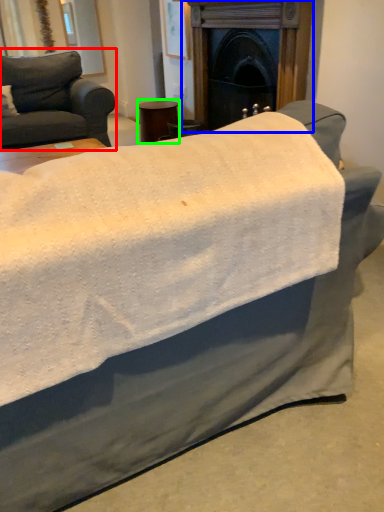
Question: Based on their relative distances, which object is farther from studio couch (highlighted by a red box)? Choose from fireplace (highlighted by a blue box) and side table (highlighted by a green box).

Choices:
 (A) fireplace
 (B) side table

Answer: (A)